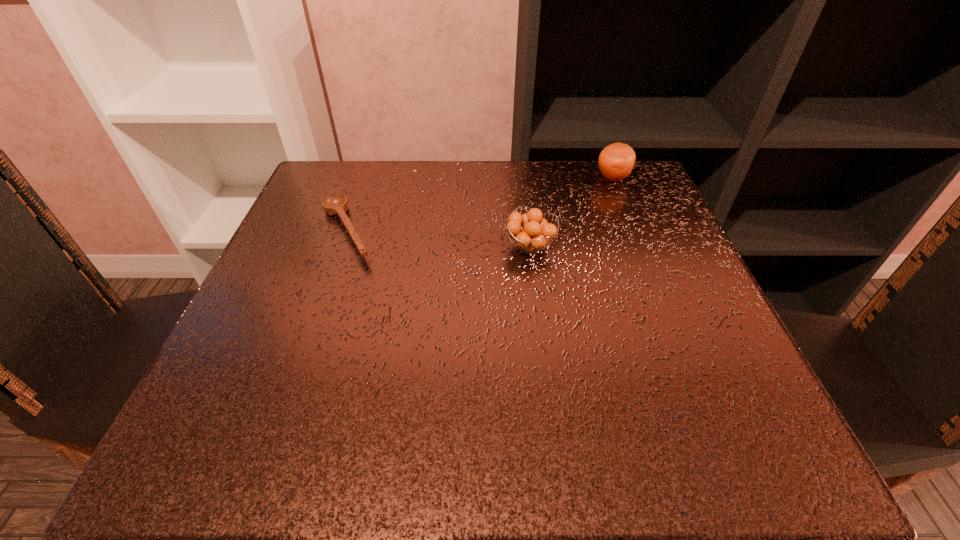
Identify the location of wooden spoon that is at the far edge. The height and width of the screenshot is (540, 960). (335, 204).

Locate an element on the screen. The image size is (960, 540). object located at the left edge is located at coordinates (335, 204).

The height and width of the screenshot is (540, 960). I want to click on object that is at the right edge, so click(616, 161).

At what (x,y) coordinates should I click in order to perform the action: click on object located in the far left corner section of the desktop. Please return your answer as a coordinate pair (x, y). Looking at the image, I should click on (335, 204).

This screenshot has width=960, height=540. Identify the location of object present at the far right corner. (616, 161).

I want to click on vacant space at the far edge, so pyautogui.click(x=507, y=196).

In the image, there is a desktop. At what (x,y) coordinates should I click in order to perform the action: click on vacant region at the near edge. Please return your answer as a coordinate pair (x, y). Looking at the image, I should click on (366, 456).

Where is `vacant space at the left edge of the desktop`? This screenshot has width=960, height=540. vacant space at the left edge of the desktop is located at coordinates (x=354, y=224).

Image resolution: width=960 pixels, height=540 pixels. Find the location of `vacant space at the right edge`. vacant space at the right edge is located at coordinates (702, 363).

In the image, there is a desktop. Where is `free region at the far left corner`? free region at the far left corner is located at coordinates (314, 218).